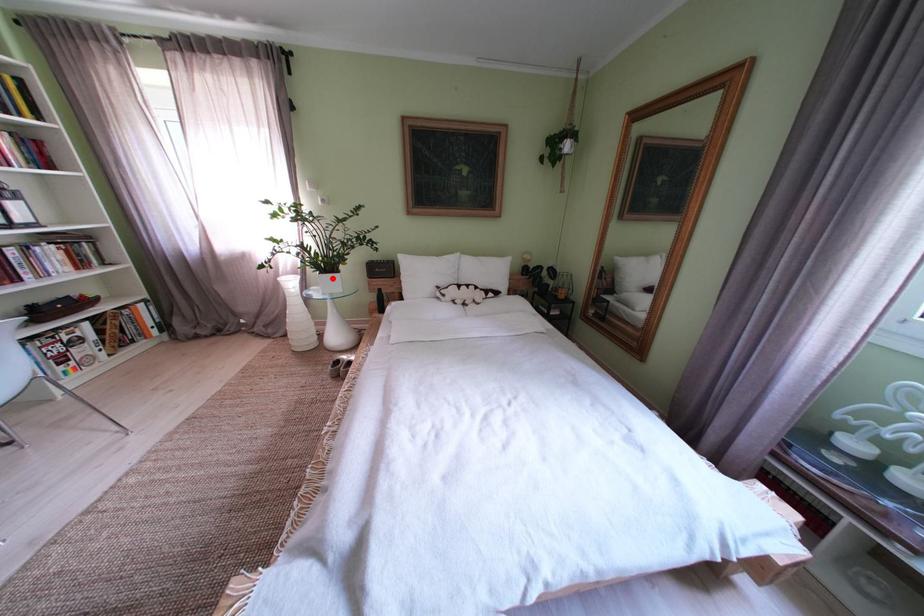
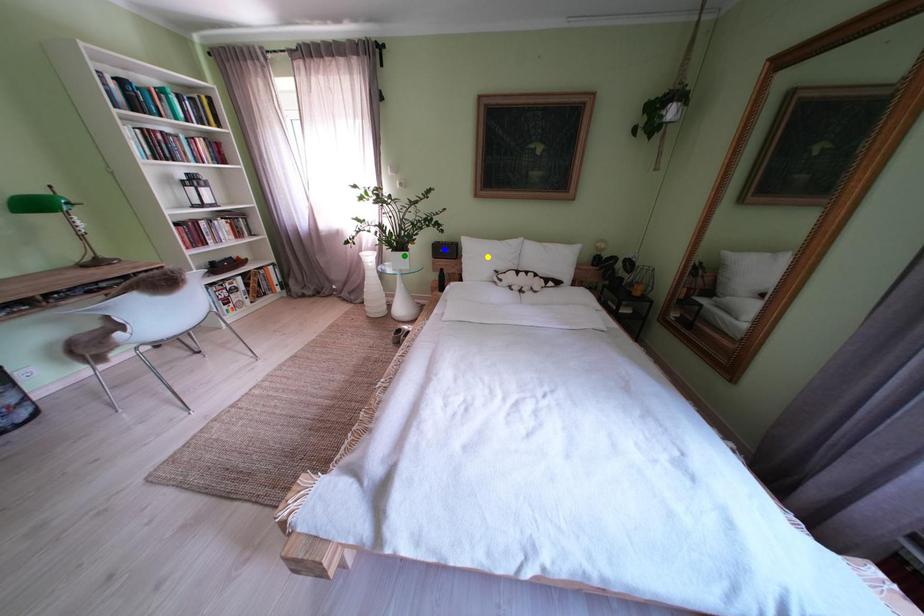
Question: I am providing you with two images of the same scene from different viewpoints. A red point is marked on the first image. You are given multiple points on the second image. Which mark in image 2 goes with the point in image 1?

Choices:
 (A) blue point
 (B) yellow point
 (C) green point

Answer: (C)